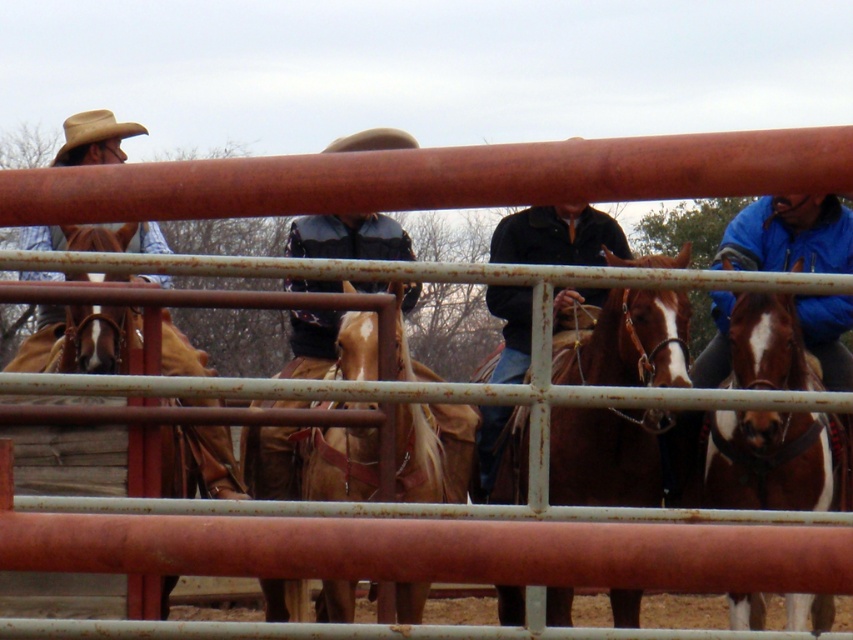
Question: Which object is positioned closest to the brown leather jacket at left?

Choices:
 (A) brown felt cowboy hat at center
 (B) brown leather horse at center
 (C) brown leather saddle at left

Answer: (C)

Question: Does brown leather horse at center lie in front of leather jacket at center?

Choices:
 (A) no
 (B) yes

Answer: (B)

Question: Is the position of black matte jacket at center less distant than that of rustic leather cowboy hat at upper left?

Choices:
 (A) no
 (B) yes

Answer: (B)

Question: Which point is farther to the camera?

Choices:
 (A) leather jacket at center
 (B) rustic leather cowboy hat at upper left

Answer: (B)

Question: From the image, what is the correct spatial relationship of brown leather horse at center in relation to brown felt cowboy hat at center?

Choices:
 (A) left
 (B) right

Answer: (B)

Question: Based on their relative distances, which object is farther from the brown leather jacket at left?

Choices:
 (A) brown felt cowboy hat at center
 (B) brown glossy horse at right
 (C) light brown leather horse at center

Answer: (A)